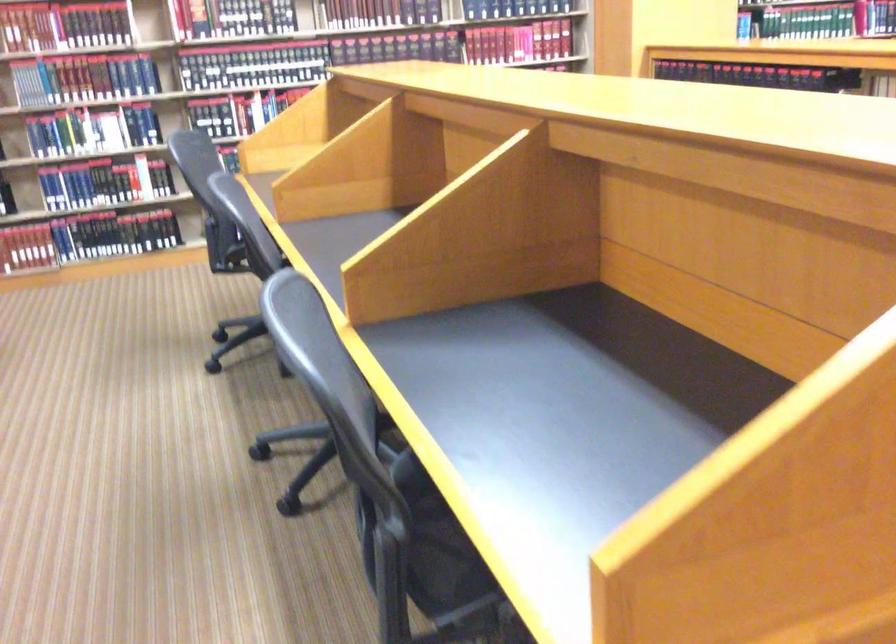
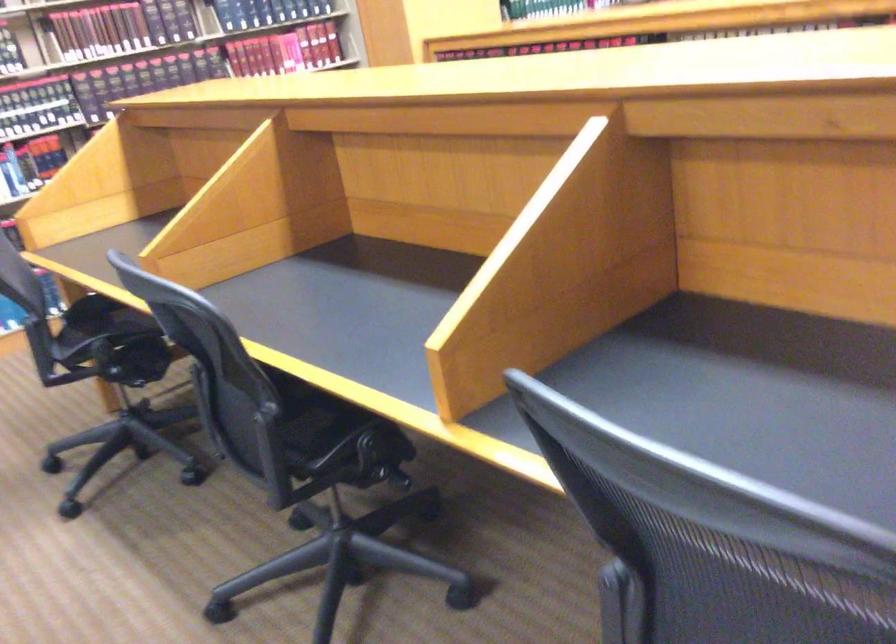
From the picture: In a continuous first-person perspective shot, in which direction is the camera moving?

The cameraman walked toward left, forward.